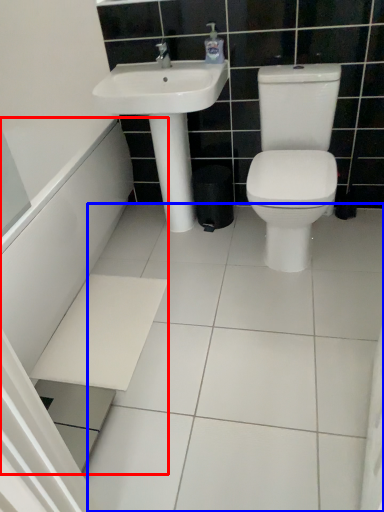
Question: Which of the following is the closest to the observer, bath (highlighted by a red box) or ceramic tile (highlighted by a blue box)?

Choices:
 (A) bath
 (B) ceramic tile

Answer: (B)